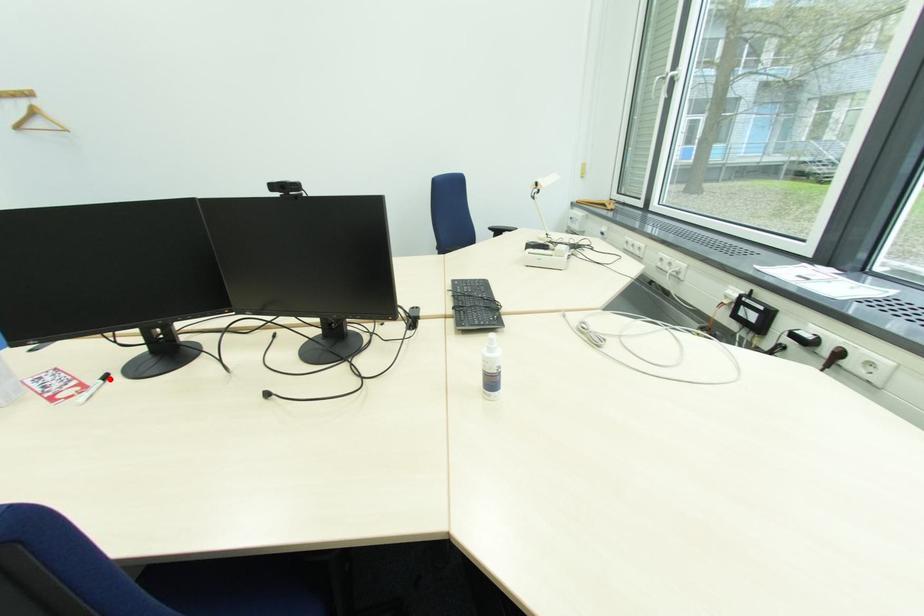
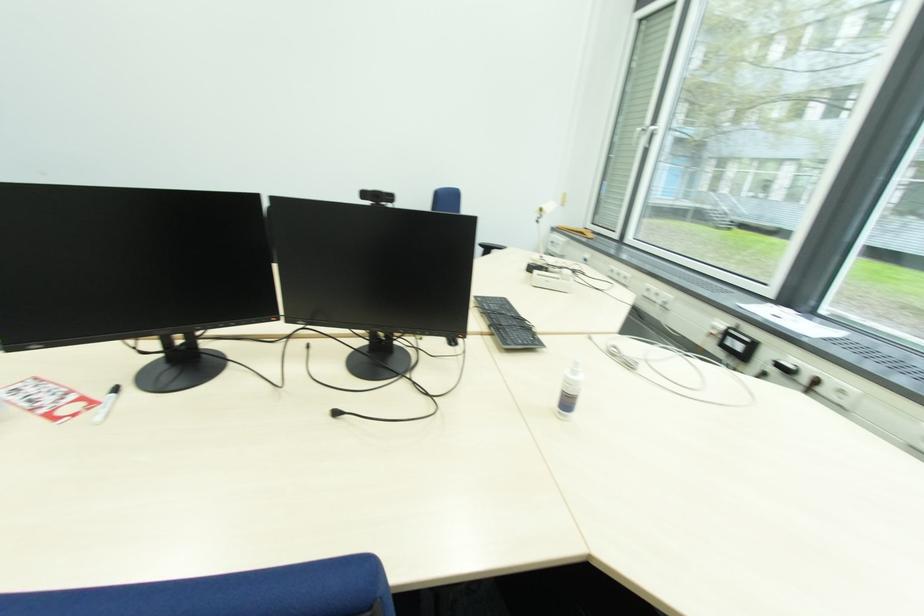
The point at the highlighted location is marked in the first image. Where is the corresponding point in the second image?

(118, 392)